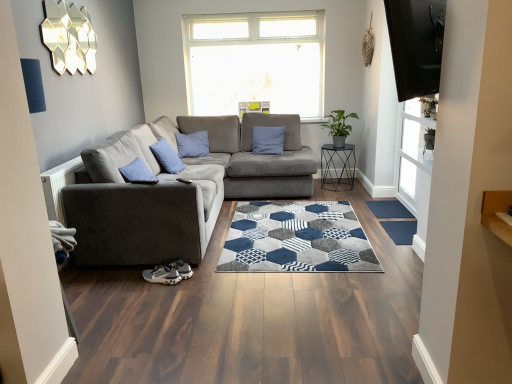
Question: Considering the positions of suede gray couch at left and dark blue textured mat at lower right in the image, is suede gray couch at left taller or shorter than dark blue textured mat at lower right?

Choices:
 (A) short
 (B) tall

Answer: (B)

Question: From a real-world perspective, is suede gray couch at left physically located above or below dark blue textured mat at lower right?

Choices:
 (A) above
 (B) below

Answer: (A)

Question: Which object is the farthest from the blue cotton pillow at center?

Choices:
 (A) dark blue textured mat at lower right
 (B) blue textured mat at lower right
 (C) metallic black side table at center-right
 (D) suede gray couch at left

Answer: (A)

Question: Which of these objects is positioned farthest from the metallic black side table at center-right?

Choices:
 (A) dark blue textured mat at lower right
 (B) blue cotton pillow at center
 (C) blue textured mat at lower right
 (D) suede gray couch at left

Answer: (D)